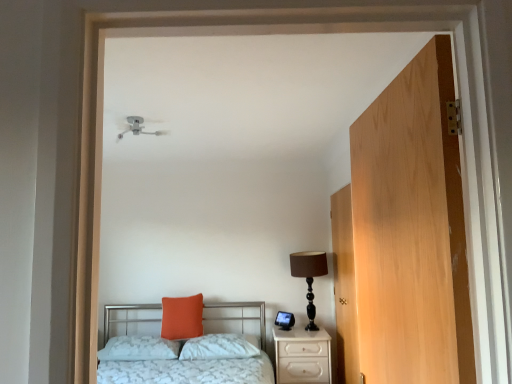
Question: From the image's perspective, is white glossy nightstand at lower right positioned above or below light wood door at right, marked as the 1th door in a left-to-right arrangement?

Choices:
 (A) above
 (B) below

Answer: (B)

Question: Considering the positions of white glossy nightstand at lower right and light wood door at right, which appears as the second door when viewed from the back, in the image, is white glossy nightstand at lower right taller or shorter than light wood door at right, which appears as the second door when viewed from the back,?

Choices:
 (A) tall
 (B) short

Answer: (B)

Question: Based on their relative distances, which object is nearer to the white glossy nightstand at lower right?

Choices:
 (A) brown fabric lampshade at right
 (B) orange matte pillow at center, the first pillow when ordered from left to right
 (C) orange fabric pillow at center, the second pillow from the left
 (D) orange matte pillow at center, positioned as the third pillow in left-to-right order
 (E) metallic silver bed at center

Answer: (E)

Question: Estimate the real-world distances between objects in this image. Which object is closer to the orange matte pillow at center, which is the first pillow in right-to-left order?

Choices:
 (A) orange fabric pillow at center, which is the second pillow in right-to-left order
 (B) light wood door at right, which appears as the second door when viewed from the back
 (C) white glossy nightstand at lower right
 (D) metallic silver bed at center
 (E) orange matte pillow at center, the first pillow when ordered from left to right

Answer: (D)